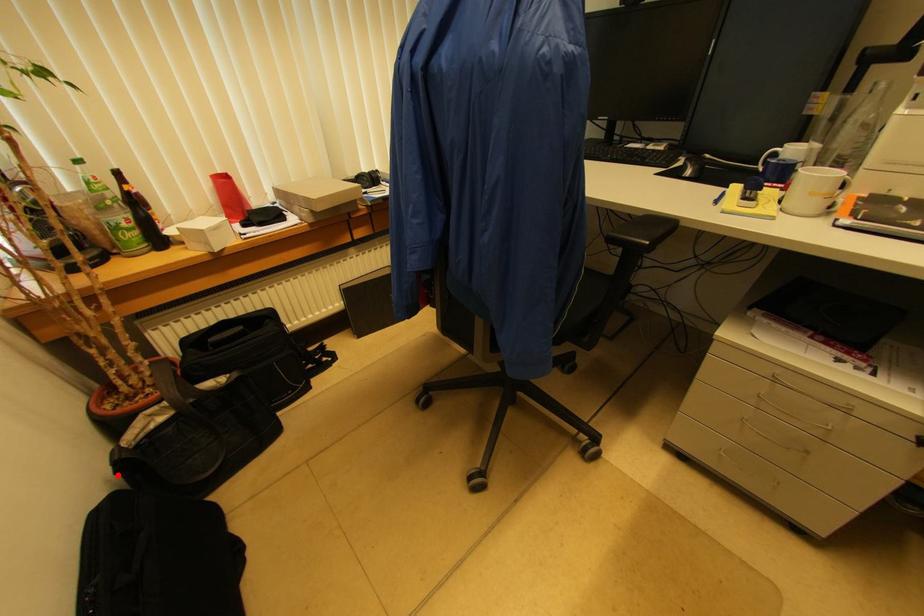
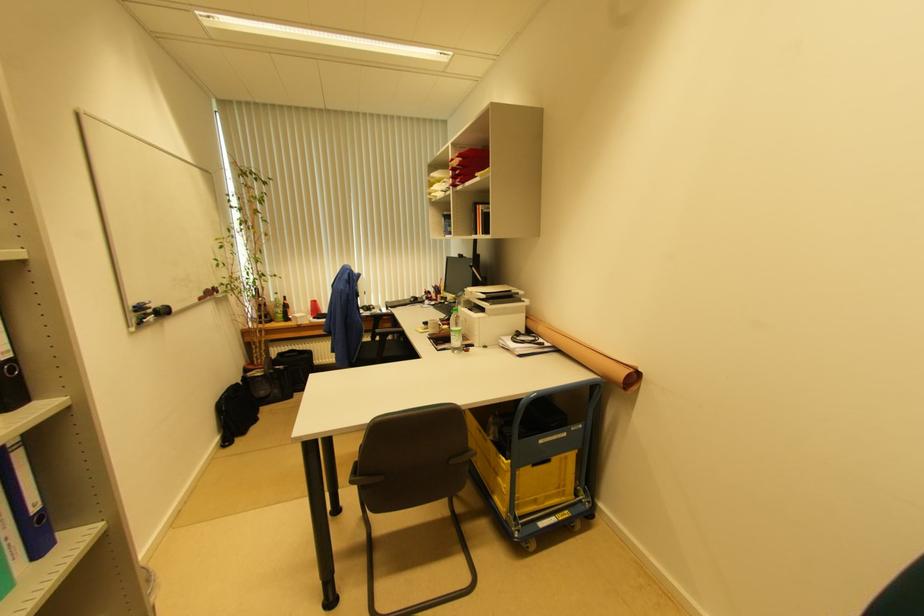
Question: I am providing you with two images of the same scene from different viewpoints. Image1 has a red point marked. In image2, the corresponding 3D location appears at what relative position? Reply with the corresponding letter.

Choices:
 (A) Closer
 (B) Farther

Answer: (B)